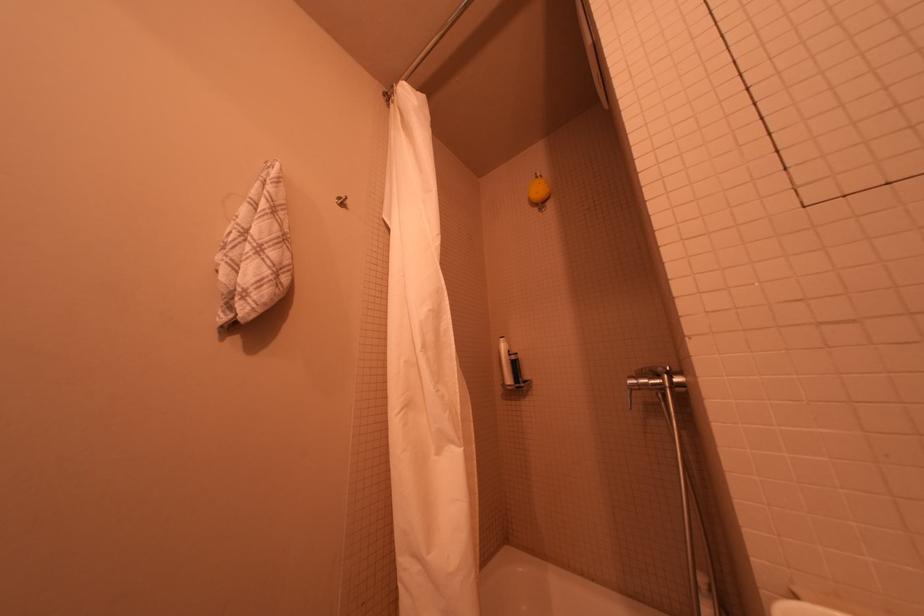
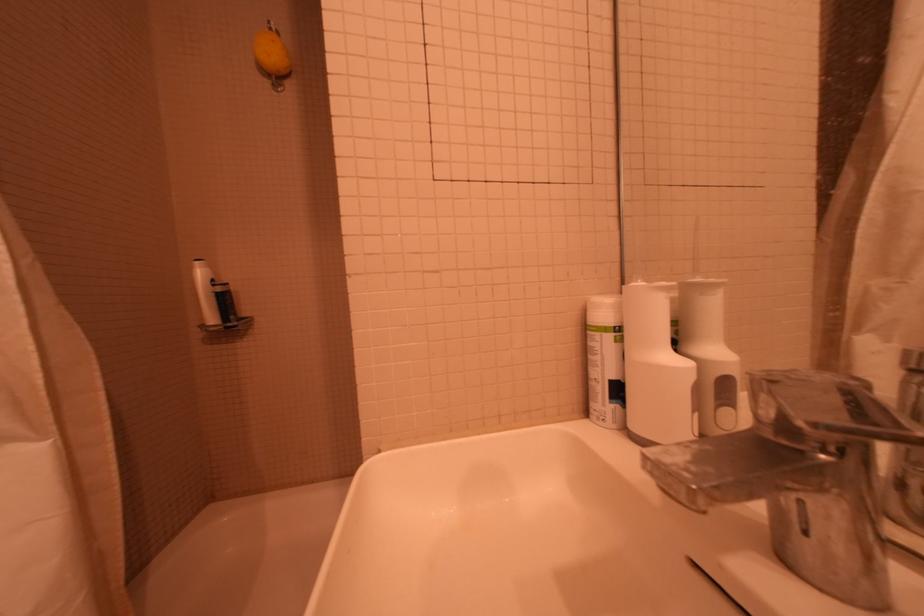
Where in the second image is the point corresponding to point (517, 355) from the first image?

(223, 286)